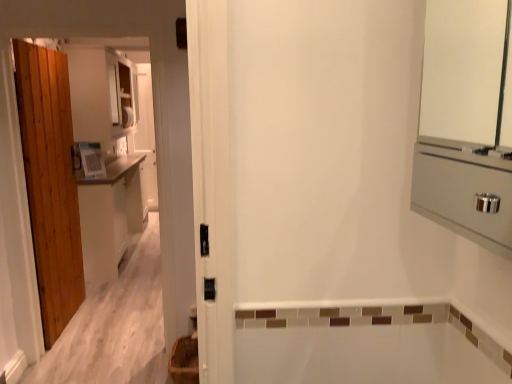
Question: Is white matte cabinet at left positioned behind brown woven basket at lower left?

Choices:
 (A) no
 (B) yes

Answer: (B)

Question: Could you tell me if white matte cabinet at left is facing brown woven basket at lower left?

Choices:
 (A) yes
 (B) no

Answer: (B)

Question: Is white matte cabinet at left next to brown woven basket at lower left?

Choices:
 (A) no
 (B) yes

Answer: (A)

Question: From the image's perspective, is white matte cabinet at left located above brown woven basket at lower left?

Choices:
 (A) yes
 (B) no

Answer: (A)

Question: Is white matte cabinet at left taller than brown woven basket at lower left?

Choices:
 (A) yes
 (B) no

Answer: (A)

Question: From a real-world perspective, is white matte cabinet at left positioned under brown woven basket at lower left based on gravity?

Choices:
 (A) yes
 (B) no

Answer: (B)

Question: Is brown woven basket at lower left oriented towards white matte cabinet at left?

Choices:
 (A) no
 (B) yes

Answer: (A)

Question: Are brown woven basket at lower left and white matte cabinet at left located far from each other?

Choices:
 (A) no
 (B) yes

Answer: (B)

Question: From a real-world perspective, is brown woven basket at lower left on white matte cabinet at left?

Choices:
 (A) no
 (B) yes

Answer: (A)

Question: Is white matte cabinet at left located within brown woven basket at lower left?

Choices:
 (A) yes
 (B) no

Answer: (B)

Question: Considering the relative positions of brown woven basket at lower left and white matte cabinet at left in the image provided, is brown woven basket at lower left behind white matte cabinet at left?

Choices:
 (A) yes
 (B) no

Answer: (B)

Question: From a real-world perspective, is brown woven basket at lower left physically below white matte cabinet at left?

Choices:
 (A) no
 (B) yes

Answer: (B)

Question: Visually, is brown woven basket at lower left positioned to the left or to the right of white matte cabinet at left?

Choices:
 (A) left
 (B) right

Answer: (B)